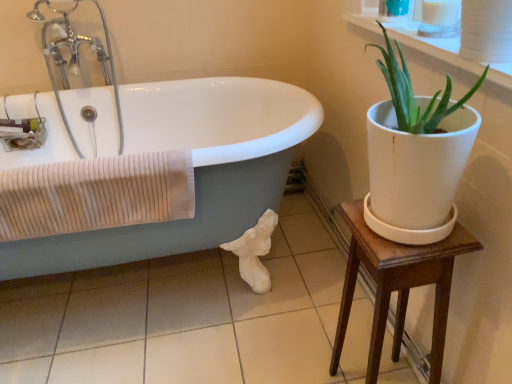
Identify the location of white ceramic plant at upper right. (432, 44).

At what (x,y) coordinates should I click in order to perform the action: click on wooden table at right. Please return your answer as a coordinate pair (x, y). Looking at the image, I should click on pos(397,285).

The height and width of the screenshot is (384, 512). What do you see at coordinates (96, 194) in the screenshot?
I see `beige ribbed towel at left` at bounding box center [96, 194].

Locate an element on the screen. white ceramic plant at upper right is located at coordinates (432, 44).

Is white glossy bathtub at left completely or partially outside of wooden table at right?

white glossy bathtub at left lies outside wooden table at right's area.

Does point (220, 45) come behind point (358, 251)?

Yes, it is behind point (358, 251).

This screenshot has width=512, height=384. Identify the location of table that appears below the white glossy bathtub at left (from the image's perspective). (397, 285).

Between white glossy bathtub at left and wooden table at right, which one has less height?

wooden table at right is shorter.

In order to click on tile on the right of beige ribbed towel at left in this screenshot , I will do `click(190, 318)`.

Is white glossy tile at lower center situated inside beige ribbed towel at left or outside?

white glossy tile at lower center is outside beige ribbed towel at left.

From a real-world perspective, which object stands above the other?

From a 3D spatial view, beige ribbed towel at left is above.

How different are the orientations of white glossy tile at lower center and beige ribbed towel at left in degrees?

The angle between the facing direction of white glossy tile at lower center and the facing direction of beige ribbed towel at left is 88.1 degrees.

Based on their positions, is white glossy bathtub at left located to the left or right of white glossy tile at lower center?

white glossy bathtub at left is to the left of white glossy tile at lower center.

Is point (217, 240) less distant than point (334, 331)?

Yes, it is in front of point (334, 331).

Consider the image. Does white glossy bathtub at left have a smaller size compared to white glossy tile at lower center?

No.

From the picture: Is white glossy bathtub at left oriented away from white glossy tile at lower center?

No, white glossy bathtub at left's orientation is not away from white glossy tile at lower center.

Between chrome metallic faucet at upper left and white ceramic plant at upper right, which one appears on the right side from the viewer's perspective?

white ceramic plant at upper right is more to the right.

Considering the relative sizes of chrome metallic faucet at upper left and white ceramic plant at upper right in the image provided, is chrome metallic faucet at upper left bigger than white ceramic plant at upper right?

Yes, chrome metallic faucet at upper left is bigger than white ceramic plant at upper right.

In the image, is chrome metallic faucet at upper left positioned in front of or behind white ceramic plant at upper right?

chrome metallic faucet at upper left is behind white ceramic plant at upper right.

How distant is chrome metallic faucet at upper left from white ceramic plant at upper right?

The distance of chrome metallic faucet at upper left from white ceramic plant at upper right is 1.11 meters.

Is chrome metallic faucet at upper left directly adjacent to white glossy tile at lower center?

No, chrome metallic faucet at upper left is not making contact with white glossy tile at lower center.

Is chrome metallic faucet at upper left taller or shorter than white glossy tile at lower center?

chrome metallic faucet at upper left is taller than white glossy tile at lower center.

Looking at their sizes, would you say white glossy bathtub at left is wider or thinner than chrome metallic faucet at upper left?

Clearly, white glossy bathtub at left has more width compared to chrome metallic faucet at upper left.

Is white glossy bathtub at left placed right next to chrome metallic faucet at upper left?

No, white glossy bathtub at left is not with chrome metallic faucet at upper left.

Can you tell me how much white glossy bathtub at left and chrome metallic faucet at upper left differ in facing direction?

0.000509 degrees.

From a real-world perspective, is white glossy bathtub at left positioned above or below chrome metallic faucet at upper left?

From a real-world perspective, white glossy bathtub at left is physically below chrome metallic faucet at upper left.

Does white ceramic plant at upper right appear on the left side of white glossy bathtub at left?

No, white ceramic plant at upper right is not to the left of white glossy bathtub at left.

From a real-world perspective, which object stands above the other?

white ceramic plant at upper right is physically above.

Considering the points (412, 29) and (226, 4), which point is behind, point (412, 29) or point (226, 4)?

Point (226, 4)

Considering the sizes of objects white ceramic plant at upper right and white glossy bathtub at left in the image provided, who is shorter, white ceramic plant at upper right or white glossy bathtub at left?

white ceramic plant at upper right.

Identify the location of table in front of the white glossy bathtub at left. (397, 285).

The width and height of the screenshot is (512, 384). I want to click on tile behind the beige ribbed towel at left, so coord(190,318).

Estimate the real-world distances between objects in this image. Which object is further from wooden table at right, white glossy bathtub at left or white ceramic plant at upper right?

white glossy bathtub at left is positioned further to the anchor wooden table at right.

When comparing their distances from white ceramic plant at upper right, does white glossy bathtub at left or wooden table at right seem further?

Among the two, white glossy bathtub at left is located further to white ceramic plant at upper right.

Based on the photo, estimate the real-world distances between objects in this image. Which object is further from chrome metallic faucet at upper left, beige ribbed towel at left or white ceramic plant at upper right?

Among the two, white ceramic plant at upper right is located further to chrome metallic faucet at upper left.

Looking at the image, which one is located closer to chrome metallic faucet at upper left, white glossy tile at lower center or wooden table at right?

white glossy tile at lower center is positioned closer to the anchor chrome metallic faucet at upper left.

Looking at the image, which one is located further to beige ribbed towel at left, white ceramic plant at upper right or wooden table at right?

white ceramic plant at upper right is further to beige ribbed towel at left.

From the picture: From the image, which object appears to be farther from white glossy tile at lower center, white glossy bathtub at left or white ceramic plant at upper right?

Among the two, white ceramic plant at upper right is located further to white glossy tile at lower center.

From the image, which object appears to be nearer to white ceramic plant at upper right, chrome metallic faucet at upper left or white glossy bathtub at left?

white glossy bathtub at left.

Based on their spatial positions, is white glossy bathtub at left or white glossy tile at lower center closer to white ceramic plant at upper right?

white glossy bathtub at left.

This screenshot has width=512, height=384. I want to click on bath towel between chrome metallic faucet at upper left and white glossy bathtub at left in the up-down direction, so coord(96,194).

This screenshot has height=384, width=512. Find the location of `table between beige ribbed towel at left and white ceramic plant at upper right`. table between beige ribbed towel at left and white ceramic plant at upper right is located at coordinates (397, 285).

Where is `bathtub between chrome metallic faucet at upper left and white glossy tile at lower center from top to bottom`? The width and height of the screenshot is (512, 384). bathtub between chrome metallic faucet at upper left and white glossy tile at lower center from top to bottom is located at coordinates (195, 179).

Find the location of a particular element. bath towel between chrome metallic faucet at upper left and wooden table at right in the horizontal direction is located at coordinates (96, 194).